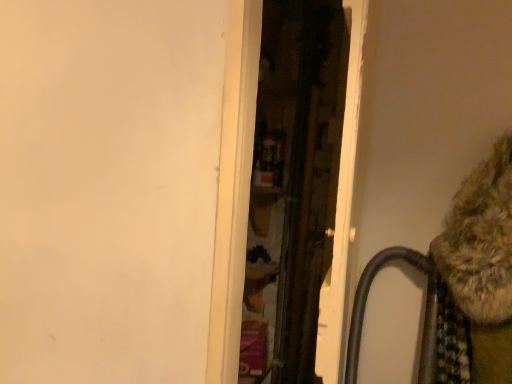
What are the coordinates of `transparent plastic shelf at center` in the screenshot? It's located at click(293, 187).

What do you see at coordinates (293, 187) in the screenshot?
I see `transparent plastic shelf at center` at bounding box center [293, 187].

This screenshot has height=384, width=512. What are the coordinates of `transparent plastic shelf at center` in the screenshot? It's located at (293, 187).